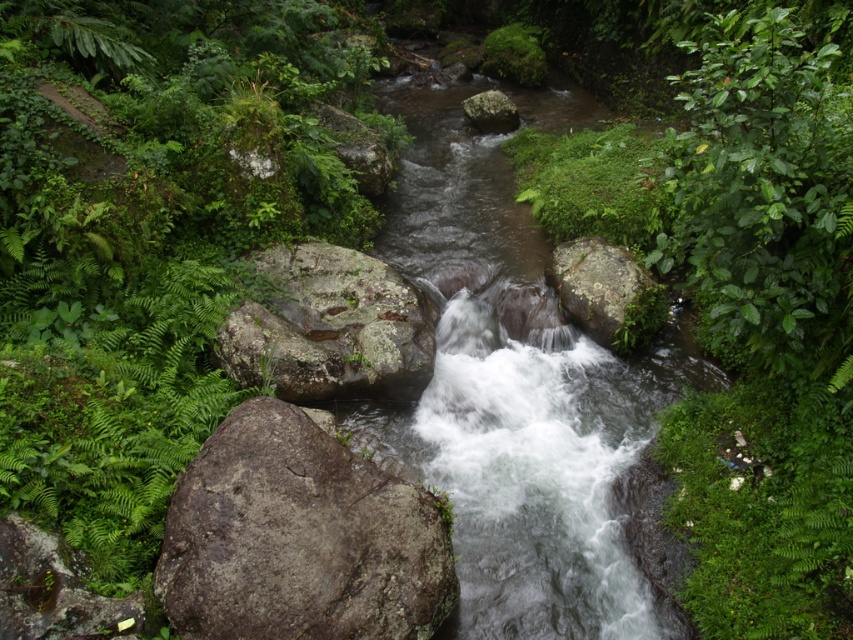
Between gray rough rock at lower left and green mossy rock at lower left, which one is positioned higher?

gray rough rock at lower left is higher up.

Does gray rough rock at lower left lie in front of green mossy rock at lower left?

No.

Who is more distant from viewer, [433,550] or [38,612]?

Positioned behind is point [433,550].

In order to click on gray rough rock at lower left in this screenshot , I will do `click(299, 538)`.

Is gray rough rock at lower left bigger than gray rough boulder at center?

Actually, gray rough rock at lower left might be smaller than gray rough boulder at center.

Locate an element on the screen. gray rough rock at lower left is located at coordinates (299, 538).

Where is `gray rough rock at lower left`? gray rough rock at lower left is located at coordinates (299, 538).

Who is more forward, (556,268) or (509,104)?

Positioned in front is point (556,268).

Does lichen-covered rock at center-right appear on the right side of green mossy rock at center?

Yes, lichen-covered rock at center-right is to the right of green mossy rock at center.

Is point (572, 250) in front of point (474, 97)?

Yes, point (572, 250) is in front of point (474, 97).

Where is `lichen-covered rock at center-right`? lichen-covered rock at center-right is located at coordinates (595, 284).